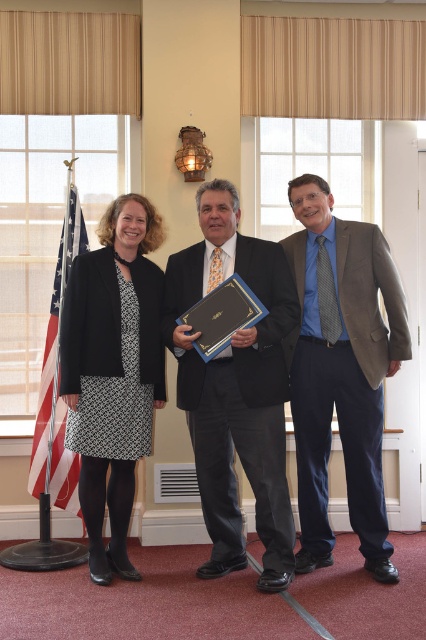
You are planning to hang a picture frame that is 1 meter tall on the wall in this scene. The frame must be placed above the black textured dress at left but below the american flag at left. Is there enough vertical space between them to fit the frame?

The black textured dress at left is below the american flag at left, but the vertical distance between them is not specified. Without knowing the exact space, it is impossible to determine if the 1 meter tall frame can fit.

You are organizing a photo shoot and need to place a small prop at a specific coordinate in the image. The coordinates given are point (342,371). Which object is located at this point?

The blue textured shirt at center is located at point (342,371).

You are a photographer setting up for a group photo. You need to ensure that the blue textured shirt at center and the blue glossy plaque at center are both visible in the frame. Based on their positions and sizes, can you confirm if both items will fit within the camera frame without cropping either?

The blue textured shirt at center might be wider than blue glossy plaque at center, so there is a possibility that the shirt may require more space. Ensure the frame accommodates the wider of the two to include both without cropping.